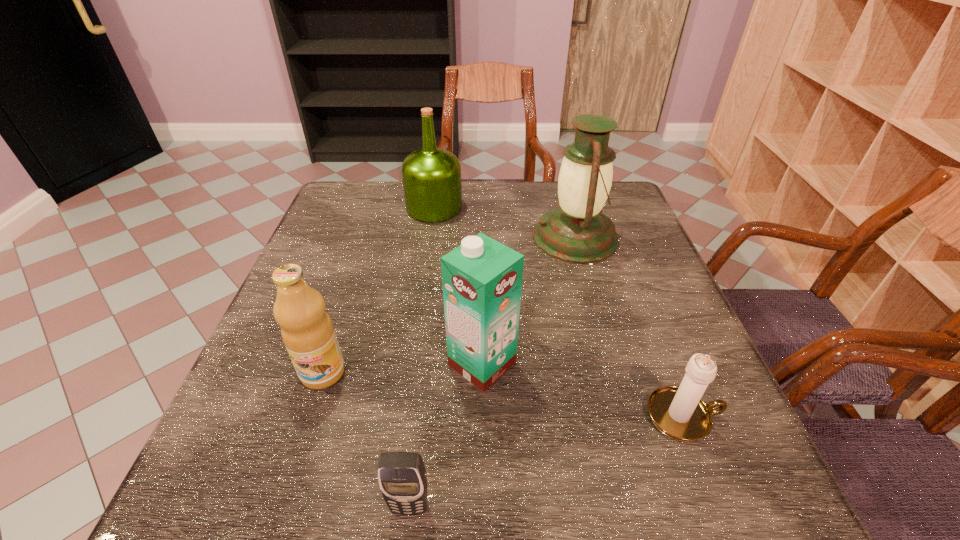
Where is `vacant space at the far edge of the desktop`? vacant space at the far edge of the desktop is located at coordinates (396, 192).

The width and height of the screenshot is (960, 540). In the image, there is a desktop. Identify the location of vacant area at the near edge. (569, 494).

Identify the location of free space at the left edge of the desktop. The height and width of the screenshot is (540, 960). (330, 233).

This screenshot has width=960, height=540. In order to click on vacant space at the right edge in this screenshot , I will do `click(652, 435)`.

Image resolution: width=960 pixels, height=540 pixels. Find the location of `vacant region between the lantern and the right olive oil`. vacant region between the lantern and the right olive oil is located at coordinates (505, 222).

Where is `free space between the nearest object and the leftmost object`? The height and width of the screenshot is (540, 960). free space between the nearest object and the leftmost object is located at coordinates (367, 440).

Identify the location of free area in between the carton and the nearest object. The image size is (960, 540). (445, 435).

The width and height of the screenshot is (960, 540). I want to click on vacant space that's between the left olive oil and the candle holder, so click(503, 394).

At what (x,y) coordinates should I click in order to perform the action: click on free space that is in between the candle holder and the right olive oil. Please return your answer as a coordinate pair (x, y). The height and width of the screenshot is (540, 960). Looking at the image, I should click on (559, 312).

This screenshot has height=540, width=960. Identify the location of free spot between the right olive oil and the leftmost object. (378, 290).